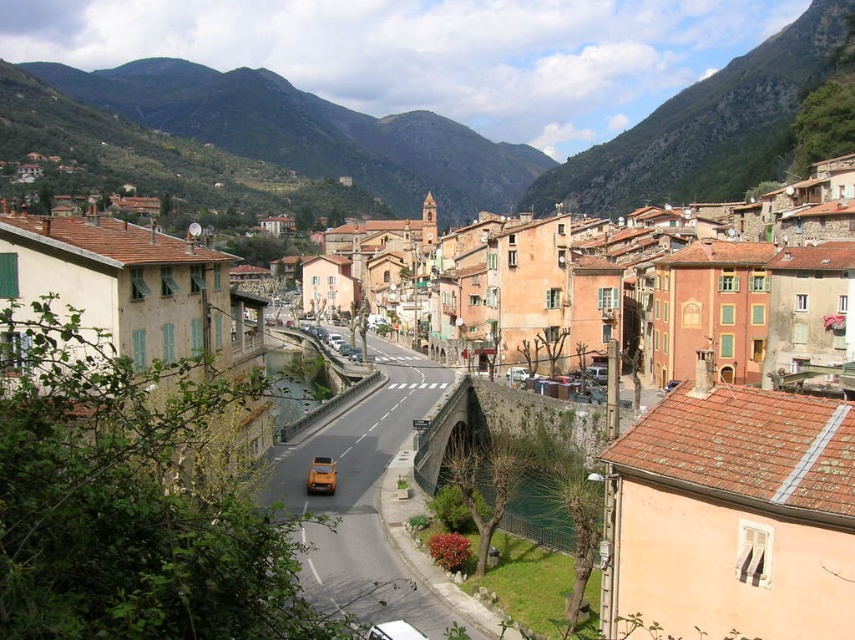
You are standing at the entrance of the town and see the green stone hillside at upper center and the metallic gold car at center. Which object is positioned to the right of the other?

The green stone hillside at upper center is to the right of the metallic gold car at center.

You are a drone operator planning to capture aerial footage of the green leafy hillside at upper center. Your drone has a maximum flight range of 400 meters. Based on the scene, can your drone safely reach the hillside without exceeding its range limit?

The distance between the green leafy hillside at upper center and the camera is 450.40 meters, which exceeds the drone maximum flight range of 400 meters. Therefore, the drone cannot safely reach the hillside without exceeding its range limit.